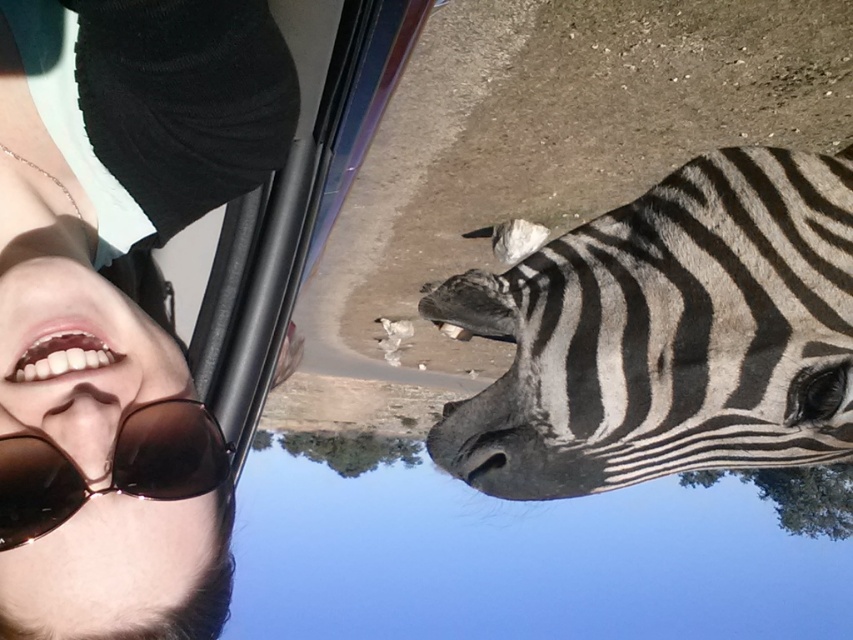
Between black and white striped zebra at center and brown matte goggles at lower left, which one is positioned lower?

brown matte goggles at lower left is lower down.

Which is more to the right, black and white striped zebra at center or brown matte goggles at lower left?

black and white striped zebra at center

Is point (503, 372) positioned in front of point (51, 516)?

No, (503, 372) is behind (51, 516).

The height and width of the screenshot is (640, 853). I want to click on black and white striped zebra at center, so click(666, 333).

Looking at this image, does brown matte goggles at lower left have a larger size compared to matte brown nose at lower left?

Yes.

Can you confirm if brown matte goggles at lower left is wider than matte brown nose at lower left?

Yes, brown matte goggles at lower left is wider than matte brown nose at lower left.

Is point (13, 518) behind point (106, 451)?

No, (13, 518) is in front of (106, 451).

Locate an element on the screen. Image resolution: width=853 pixels, height=640 pixels. brown matte goggles at lower left is located at coordinates (109, 467).

Does black and white striped zebra at center appear on the left side of matte brown nose at lower left?

Incorrect, black and white striped zebra at center is not on the left side of matte brown nose at lower left.

Who is more forward, [514,458] or [84,429]?

Point [84,429] is in front.

At what (x,y) coordinates should I click in order to perform the action: click on black and white striped zebra at center. Please return your answer as a coordinate pair (x, y). This screenshot has height=640, width=853. Looking at the image, I should click on (x=666, y=333).